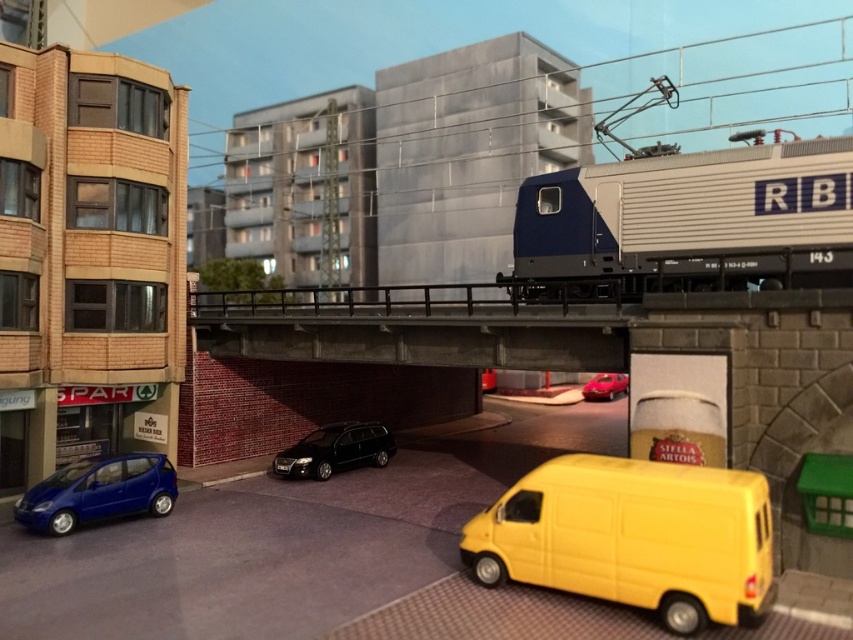
You are a delivery person trying to park your vehicle in the smooth concrete parking garage at center. There is a yellow matte van at lower right blocking the entrance. Can you drive around it to access the garage?

The smooth concrete parking garage at center is closer to you than the yellow matte van at lower right, so you can drive around the van to access the garage.

You are standing at the point labeled point (312,296). You need to walk to the yellow van parked on the street to the right of the SPAR building. How far will you have to walk in meters?

The distance between you and the yellow van parked on the street to the right of the SPAR building is 44.80 meters.

You are a delivery driver who needs to park your vehicle in the smooth concrete parking garage at center. However, your van is the same size as the yellow matte van at lower right. Can your van fit into the garage?

The smooth concrete parking garage at center is larger in size than the yellow matte van at lower right, so yes, your van can fit into the garage since the garage is bigger than the van.